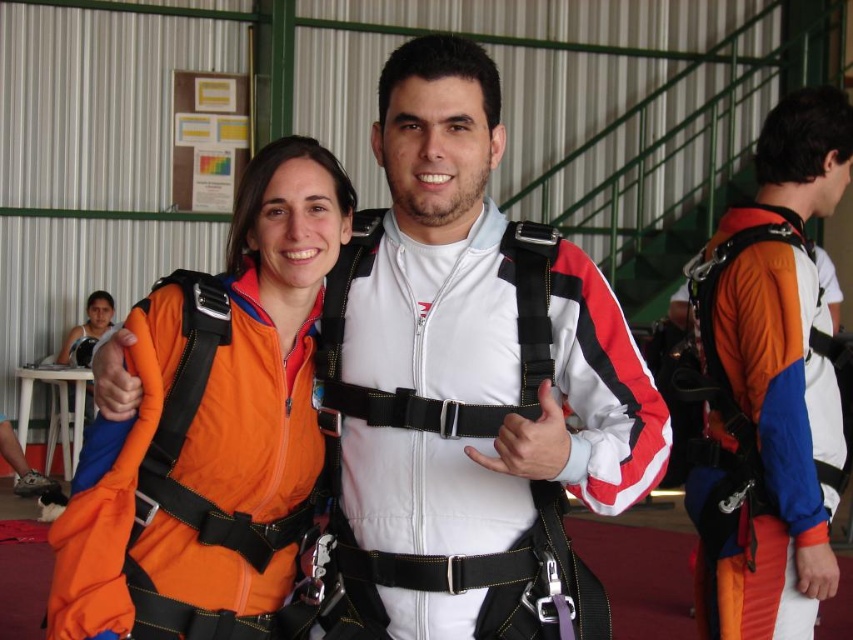
How much distance is there between white matte jumpsuit at center and orange fabric jumpsuit at right?

white matte jumpsuit at center is 1.10 meters from orange fabric jumpsuit at right.

Is point (547, 451) positioned before point (796, 305)?

Yes, point (547, 451) is in front of point (796, 305).

This screenshot has height=640, width=853. I want to click on white matte jumpsuit at center, so click(468, 387).

Between point (169, 330) and point (770, 529), which one is positioned in front?

Point (169, 330)

Is orange fabric jumpsuit at center closer to the viewer compared to orange fabric jumpsuit at right?

That is True.

Where is `orange fabric jumpsuit at center`? This screenshot has height=640, width=853. orange fabric jumpsuit at center is located at coordinates (213, 419).

Can you confirm if white matte jumpsuit at center is bigger than orange fabric jumpsuit at center?

Correct, white matte jumpsuit at center is larger in size than orange fabric jumpsuit at center.

Does white matte jumpsuit at center appear under orange fabric jumpsuit at center?

No, white matte jumpsuit at center is not below orange fabric jumpsuit at center.

Who is more distant from viewer, (x=494, y=624) or (x=305, y=381)?

The point (x=305, y=381) is behind.

This screenshot has height=640, width=853. What are the coordinates of `white matte jumpsuit at center` in the screenshot? It's located at (468, 387).